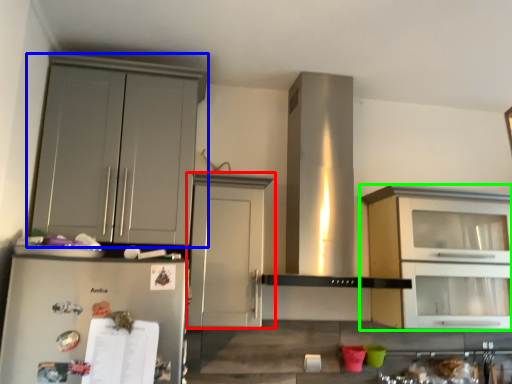
Question: Considering the real-world distances, which object is closest to cabinetry (highlighted by a red box)? cabinetry (highlighted by a blue box) or cabinetry (highlighted by a green box).

Choices:
 (A) cabinetry
 (B) cabinetry

Answer: (A)